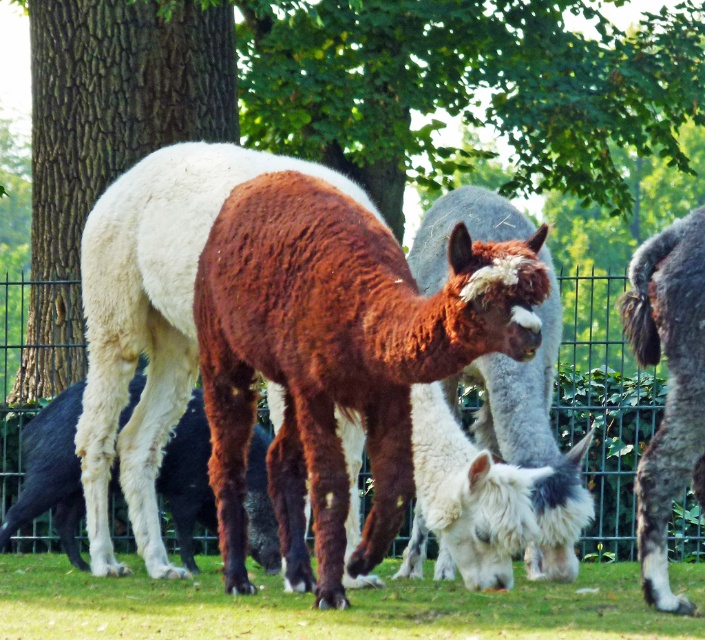
Question: Is brown textured tree trunk at upper left bigger than green grass at lower center?

Choices:
 (A) no
 (B) yes

Answer: (A)

Question: Can you confirm if brown textured tree trunk at upper left is positioned to the left of green wire fence at center?

Choices:
 (A) yes
 (B) no

Answer: (B)

Question: Which of these objects is positioned farthest from the green wire fence at center?

Choices:
 (A) brown woolen alpaca at center
 (B) brown textured tree trunk at upper left

Answer: (A)

Question: Which of the following is the closest to the observer?

Choices:
 (A) [x=130, y=424]
 (B) [x=39, y=365]
 (C) [x=85, y=80]
 (D) [x=343, y=620]

Answer: (D)

Question: Which point appears closest to the camera in this image?

Choices:
 (A) (404, 589)
 (B) (82, 61)
 (C) (116, 269)
 (D) (216, 81)

Answer: (A)

Question: Does brown woolen alpaca at center come behind green grass at lower center?

Choices:
 (A) yes
 (B) no

Answer: (A)